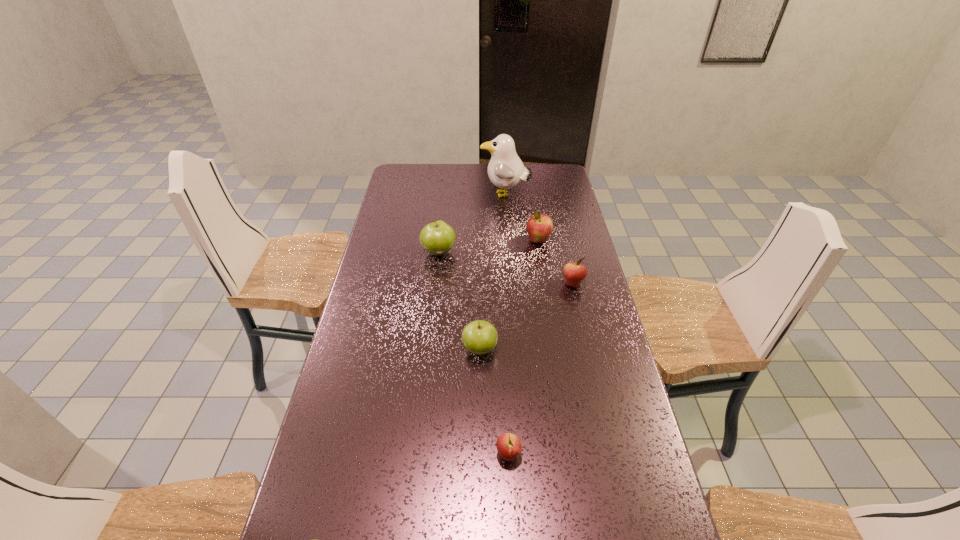
Image resolution: width=960 pixels, height=540 pixels. What are the coordinates of `the second closest object to the farthest object` in the screenshot? It's located at (437, 238).

The width and height of the screenshot is (960, 540). In order to click on apple that stands as the fourth closest to the fourth nearest object in this screenshot , I will do `click(509, 446)`.

Locate which apple is the second closest to the second nearest green apple. Please provide its 2D coordinates. Your answer should be formatted as a tuple, i.e. [(x, y)], where the tuple contains the x and y coordinates of a point satisfying the conditions above.

[(574, 273)]

Locate which red apple ranks third in proximity to the second green apple from left to right. Please provide its 2D coordinates. Your answer should be formatted as a tuple, i.e. [(x, y)], where the tuple contains the x and y coordinates of a point satisfying the conditions above.

[(509, 446)]

Identify which red apple is the nearest to the second green apple from right to left. Please provide its 2D coordinates. Your answer should be formatted as a tuple, i.e. [(x, y)], where the tuple contains the x and y coordinates of a point satisfying the conditions above.

[(539, 227)]

Select which green apple is the closest to the leftmost red apple. Please provide its 2D coordinates. Your answer should be formatted as a tuple, i.e. [(x, y)], where the tuple contains the x and y coordinates of a point satisfying the conditions above.

[(479, 337)]

Where is `green apple that is the third closest to the farthest red apple`? This screenshot has width=960, height=540. green apple that is the third closest to the farthest red apple is located at coordinates (314, 539).

Identify the location of free location that satisfies the following two spatial constraints: 1. on the front side of the second apple from left to right; 2. on the left side of the nearest red apple. Image resolution: width=960 pixels, height=540 pixels. (417, 455).